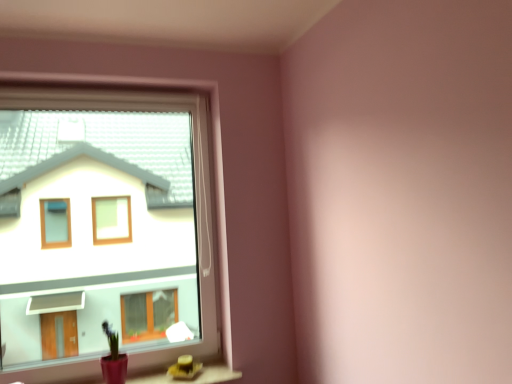
You are a GUI agent. You are given a task and a screenshot of the screen. Output one action in this format:
    pyautogui.click(x=<x>, y=<y>)
    Task: Click on the transparent plastic window at upper left
    This screenshot has height=384, width=512.
    Given the screenshot: What is the action you would take?
    pyautogui.click(x=103, y=230)

Describe the element at coordinates (103, 230) in the screenshot. I see `transparent plastic window at upper left` at that location.

Image resolution: width=512 pixels, height=384 pixels. What are the coordinates of `matte pink pot at lower left` in the screenshot? It's located at (113, 359).

What is the approximate width of matte pink pot at lower left?

matte pink pot at lower left is 7.24 inches in width.

The height and width of the screenshot is (384, 512). Describe the element at coordinates (113, 359) in the screenshot. I see `matte pink pot at lower left` at that location.

The image size is (512, 384). What are the coordinates of `transparent plastic window at upper left` in the screenshot? It's located at (103, 230).

Considering the relative positions of matte pink pot at lower left and transparent plastic window at upper left in the image provided, is matte pink pot at lower left to the left of transparent plastic window at upper left from the viewer's perspective?

In fact, matte pink pot at lower left is to the right of transparent plastic window at upper left.

Does matte pink pot at lower left come in front of transparent plastic window at upper left?

No, it is not.

Between point (126, 370) and point (150, 108), which one is positioned in front?

The point (126, 370) is closer.

From the image's perspective, which is below, matte pink pot at lower left or transparent plastic window at upper left?

matte pink pot at lower left.

From a real-world perspective, who is located lower, matte pink pot at lower left or transparent plastic window at upper left?

From a 3D spatial view, matte pink pot at lower left is below.

Which object is thinner, matte pink pot at lower left or transparent plastic window at upper left?

With smaller width is transparent plastic window at upper left.

Looking at this image, which of these two, matte pink pot at lower left or transparent plastic window at upper left, stands taller?

transparent plastic window at upper left.

Between matte pink pot at lower left and transparent plastic window at upper left, which one has smaller size?

matte pink pot at lower left.

Is matte pink pot at lower left not within transparent plastic window at upper left?

A: That's incorrect, matte pink pot at lower left is not completely outside transparent plastic window at upper left.

Is matte pink pot at lower left directly adjacent to transparent plastic window at upper left?

No, matte pink pot at lower left is not touching transparent plastic window at upper left.

Is matte pink pot at lower left facing towards transparent plastic window at upper left?

No, matte pink pot at lower left does not turn towards transparent plastic window at upper left.

I want to click on window in front of the matte pink pot at lower left, so click(x=103, y=230).

Which object is positioned more to the right, transparent plastic window at upper left or matte pink pot at lower left?

Positioned to the right is matte pink pot at lower left.

Is the depth of transparent plastic window at upper left less than that of matte pink pot at lower left?

Yes, transparent plastic window at upper left is closer to the camera.

Is point (116, 191) positioned after point (115, 351)?

Yes, it is behind point (115, 351).

From the image's perspective, which one is positioned higher, transparent plastic window at upper left or matte pink pot at lower left?

transparent plastic window at upper left, from the image's perspective.

Consider the image. From a real-world perspective, is transparent plastic window at upper left physically above matte pink pot at lower left?

Yes, from a real-world perspective, transparent plastic window at upper left is on top of matte pink pot at lower left.

Consider the image. Which object is wider, transparent plastic window at upper left or matte pink pot at lower left?

Wider between the two is matte pink pot at lower left.

Which of these two, transparent plastic window at upper left or matte pink pot at lower left, stands shorter?

Standing shorter between the two is matte pink pot at lower left.

Is transparent plastic window at upper left bigger or smaller than matte pink pot at lower left?

Clearly, transparent plastic window at upper left is larger in size than matte pink pot at lower left.

Is matte pink pot at lower left inside transparent plastic window at upper left?

Yes, matte pink pot at lower left is inside transparent plastic window at upper left.

Is transparent plastic window at upper left in contact with matte pink pot at lower left?

No, transparent plastic window at upper left is not next to matte pink pot at lower left.

Is transparent plastic window at upper left facing away from matte pink pot at lower left?

Absolutely, transparent plastic window at upper left is directed away from matte pink pot at lower left.

Can you tell me how much transparent plastic window at upper left and matte pink pot at lower left differ in facing direction?

The angular difference between transparent plastic window at upper left and matte pink pot at lower left is 1.54 degrees.

Where is `window above the matte pink pot at lower left (from a real-world perspective)`? Image resolution: width=512 pixels, height=384 pixels. window above the matte pink pot at lower left (from a real-world perspective) is located at coordinates (103, 230).

Locate an element on the screen. The image size is (512, 384). window in front of the matte pink pot at lower left is located at coordinates (103, 230).

Identify the location of window above the matte pink pot at lower left (from a real-world perspective). This screenshot has width=512, height=384. (103, 230).